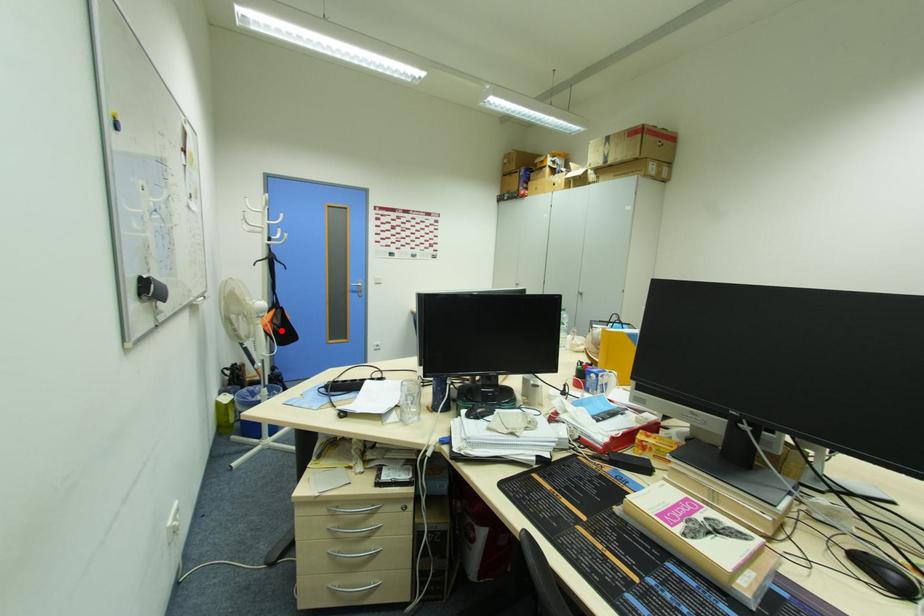
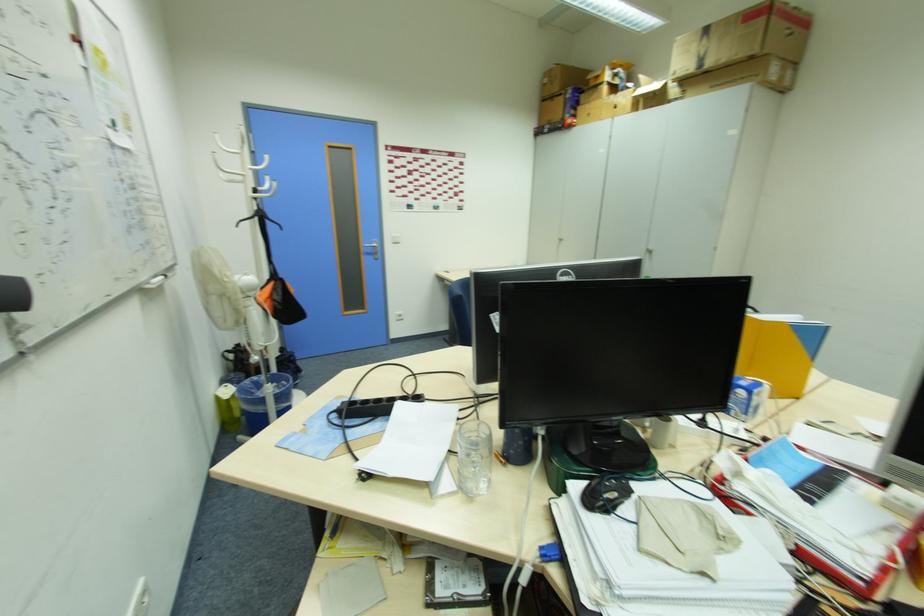
Question: I am providing you with two images of the same scene from different viewpoints. In image1, a red point is highlighted. Considering the same 3D point in image2, which of the following is correct?

Choices:
 (A) It is closer
 (B) It is farther

Answer: (B)